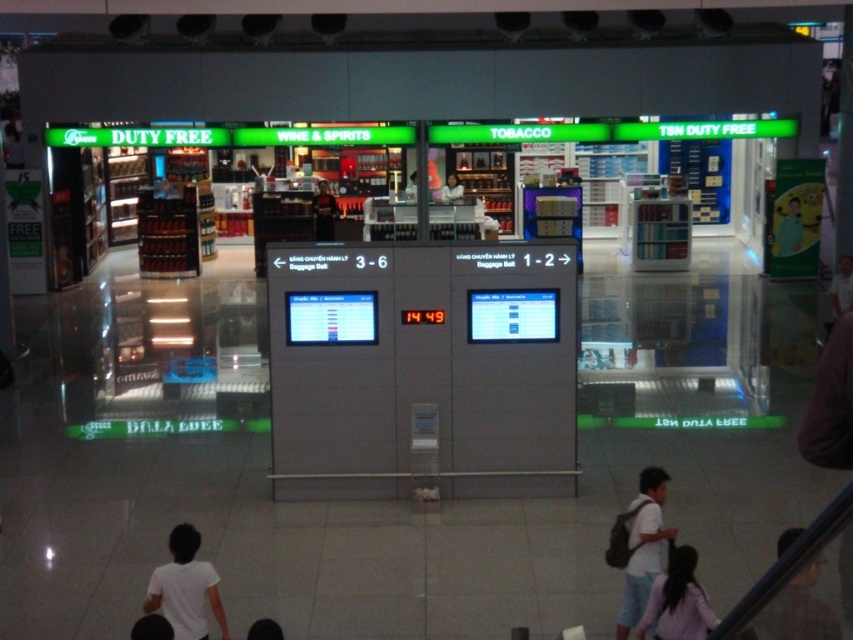
You are a traveler standing in the duty free area and want to locate two points marked in the scene. Which of the two points, point (660, 536) or point (821, 634), is closer to you?

Point (660, 536) is closer to you because it is further to the viewer than point (821, 634).

In the scene shown: You are a traveler standing at the center of the duty free area. You see a person with dark brown hair at lower right and a person wearing a smooth white shirt at center. Which person is closer to you?

The smooth white shirt at center is closer to you since it is located at the center of the duty free area, while the dark brown hair at lower right is further away.

You are a traveler standing in the duty free area and you see a person with a white cotton shirt at lower right and dark brown hair at lower right. Which part of the person is wider?

The white cotton shirt at lower right is wider than the dark brown hair at lower right.